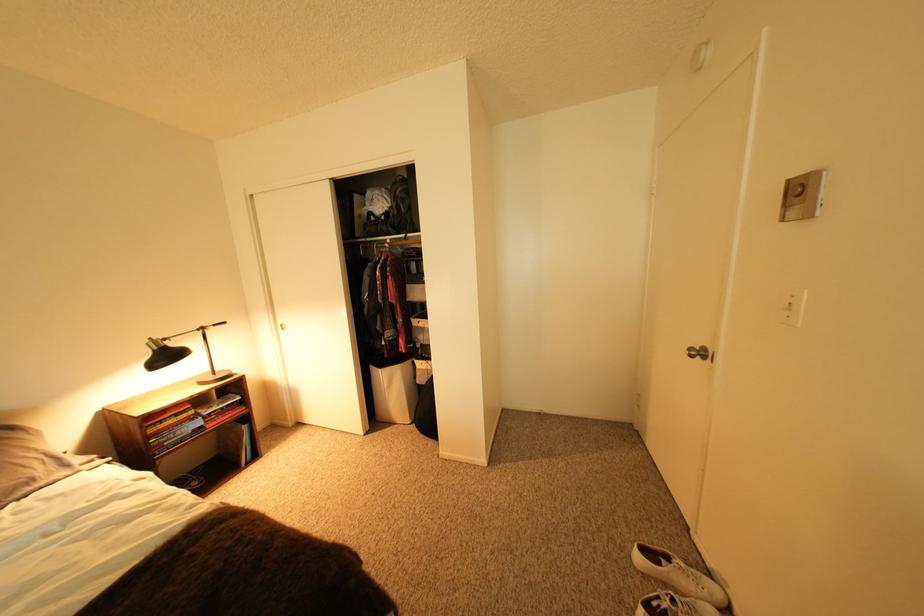
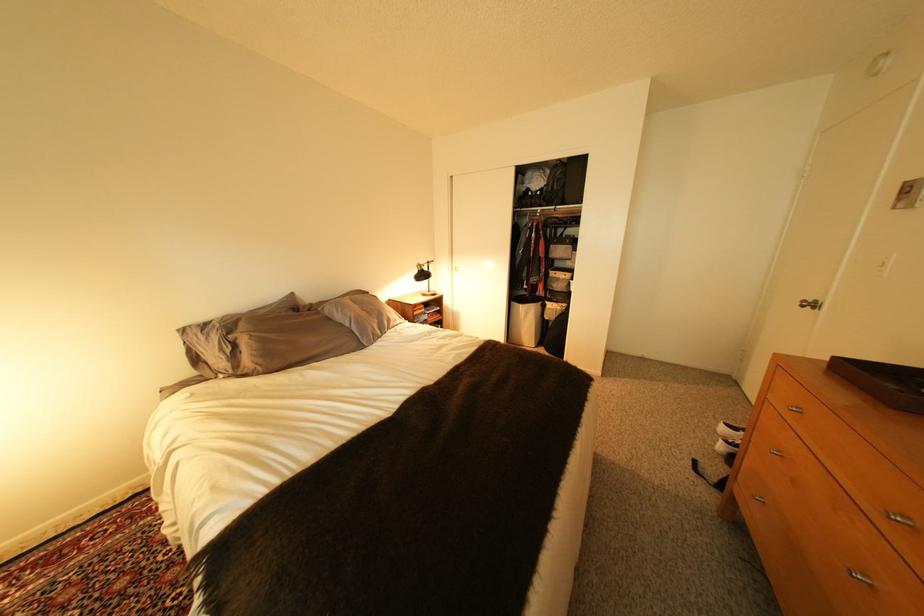
Where in the second image is the point corresponding to point 393,371 from the first image?

(533, 307)